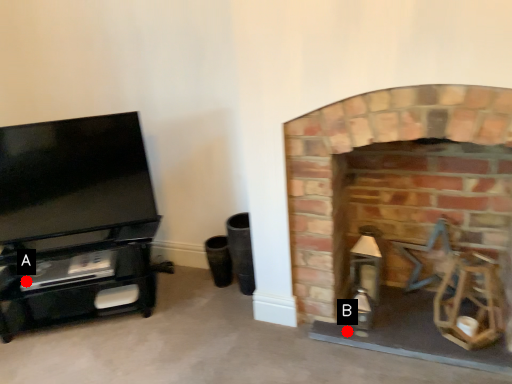
Question: Two points are circled on the image, labeled by A and B beside each circle. Which of the following is the closest to the observer?

Choices:
 (A) A is closer
 (B) B is closer

Answer: (B)